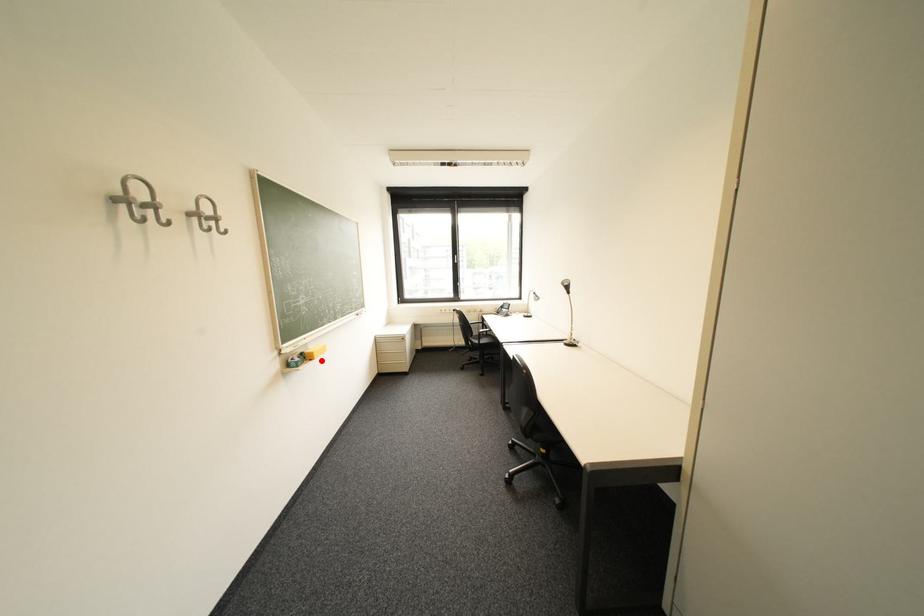
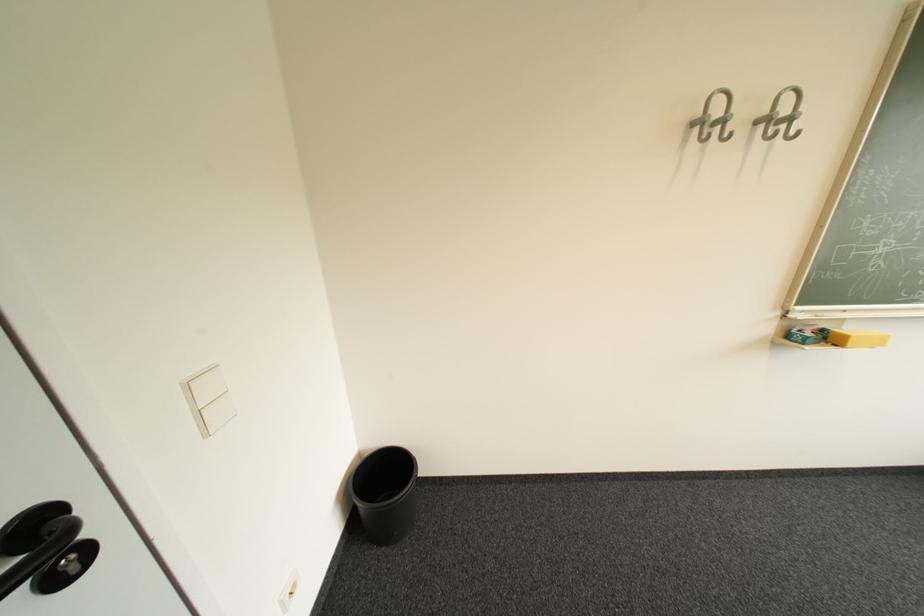
Locate, in the second image, the point that corresponds to the highlighted location in the first image.

(846, 346)